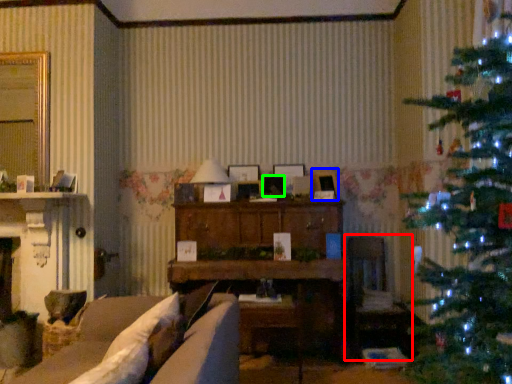
Question: Based on their relative distances, which object is farther from armchair (highlighted by a red box)? Choose from picture frame (highlighted by a blue box) and picture frame (highlighted by a green box).

Choices:
 (A) picture frame
 (B) picture frame

Answer: (B)